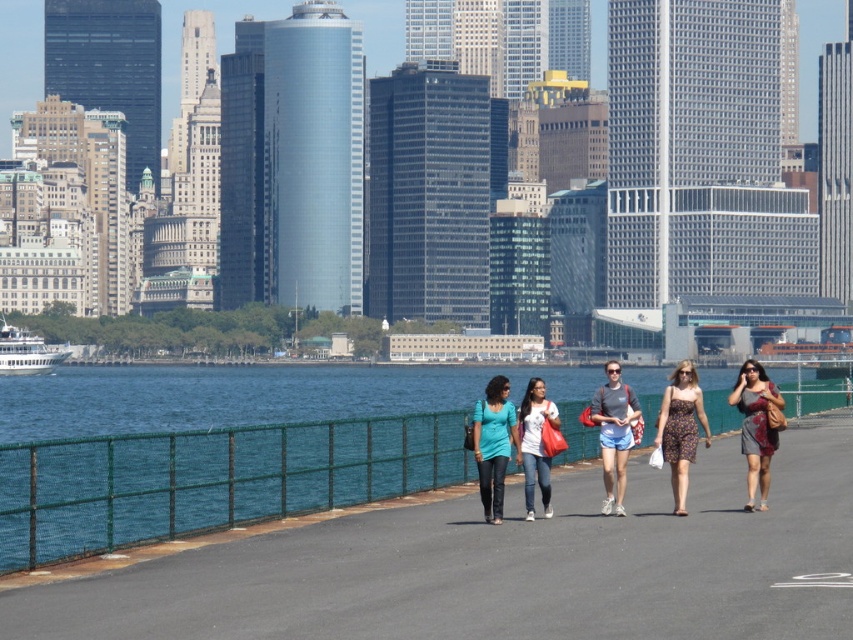
Question: Is asphalt at center above matte teal shirt at center?

Choices:
 (A) no
 (B) yes

Answer: (A)

Question: Which point is farther from the camera taking this photo?

Choices:
 (A) click(746, 380)
 (B) click(621, 461)

Answer: (A)

Question: Does printed fabric dress at center right appear over white matte t-shirt at center?

Choices:
 (A) no
 (B) yes

Answer: (B)

Question: Is matte teal shirt at center wider than matte gray t-shirt at center?

Choices:
 (A) yes
 (B) no

Answer: (B)

Question: Among these objects, which one is farthest from the camera?

Choices:
 (A) asphalt at center
 (B) floral print dress at center
 (C) matte teal shirt at center

Answer: (B)

Question: Which point is farther from the camera taking this photo?

Choices:
 (A) (711, 480)
 (B) (543, 493)
 (C) (699, 397)

Answer: (A)